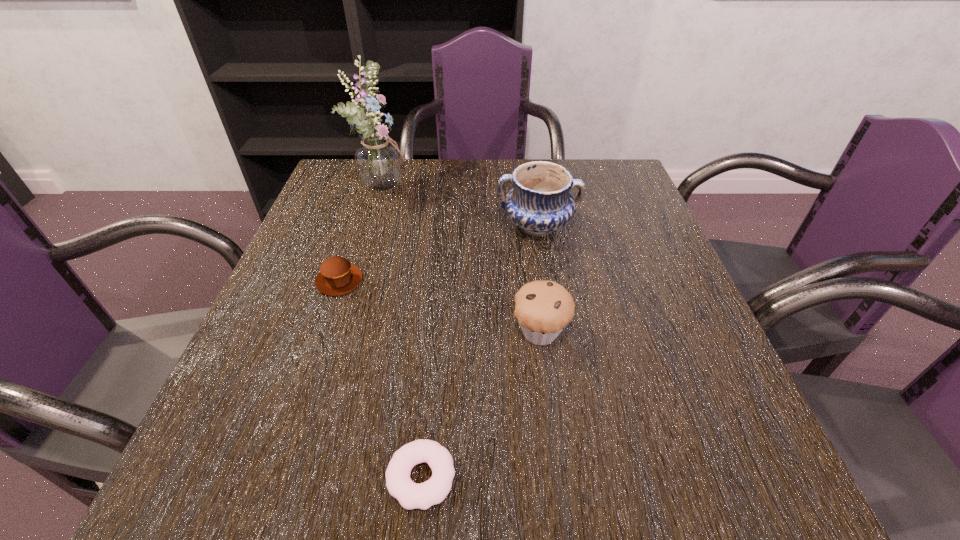
The image size is (960, 540). In order to click on bouquet in this screenshot , I will do `click(378, 160)`.

Identify the location of pottery. 539,203.

What are the coordinates of `the third tallest object` in the screenshot? It's located at (543, 309).

Identify the location of the nearer muffin. The width and height of the screenshot is (960, 540). (543, 309).

This screenshot has width=960, height=540. I want to click on the left muffin, so click(x=337, y=276).

Where is `the farther muffin`? The width and height of the screenshot is (960, 540). the farther muffin is located at coordinates (337, 276).

Identify the location of doughnut. (410, 495).

This screenshot has height=540, width=960. Find the location of `the third object from left to right`. the third object from left to right is located at coordinates (410, 495).

This screenshot has width=960, height=540. Identify the location of vacant area situated on the front-facing side of the tallest object. (443, 185).

Image resolution: width=960 pixels, height=540 pixels. Find the location of `vacant space located 0.160m on the right of the pottery`. vacant space located 0.160m on the right of the pottery is located at coordinates (644, 226).